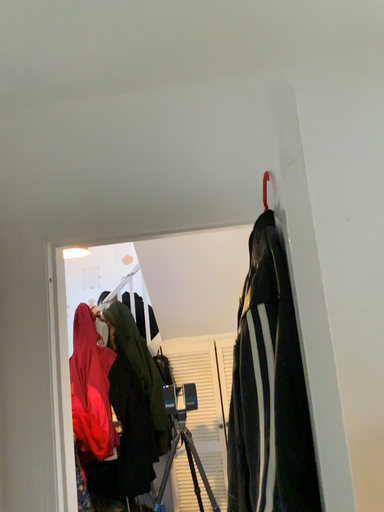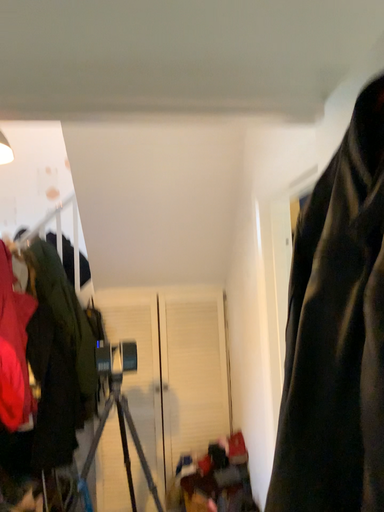
Question: Which way did the camera rotate in the video?

Choices:
 (A) rotated right
 (B) rotated left

Answer: (A)